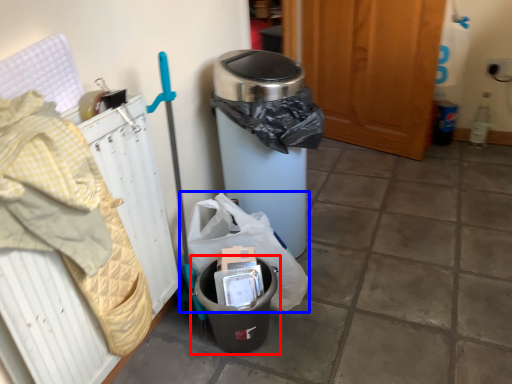
Question: Among these objects, which one is farthest to the camera, waste container (highlighted by a red box) or garbage (highlighted by a blue box)?

Choices:
 (A) waste container
 (B) garbage

Answer: (B)